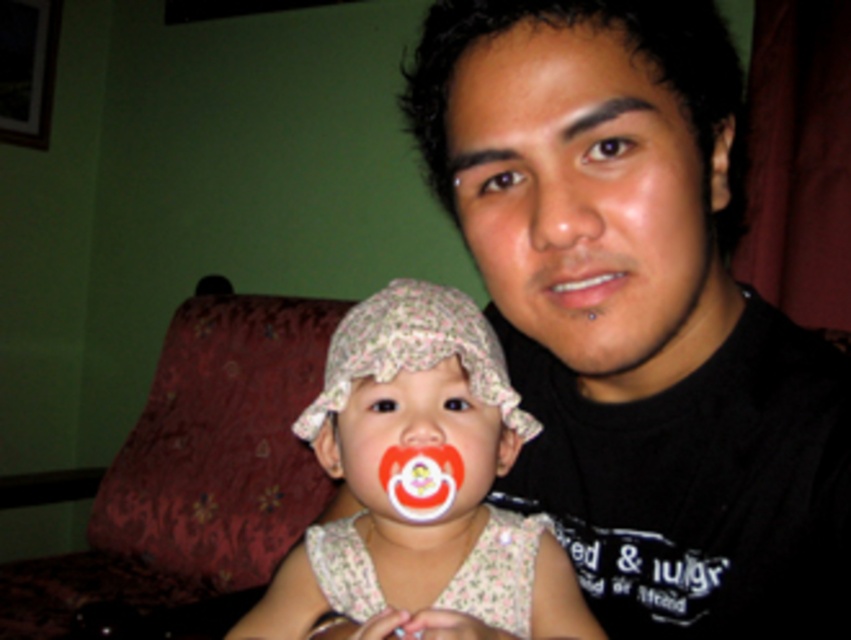
You are standing in the room and see two points marked in the image. Which point is closer to you, point (660, 188) or point (541, 76)?

Point (541, 76) is closer to you because the description states that point (660, 188) is behind point (541, 76).

Consider the image. You are a photographer trying to capture a closeup shot of both the matte black shirt at center and the matte white teeth at center in the image. The camera lens has a maximum focus range of 6 inches. Can you focus on both subjects simultaneously?

The matte black shirt at center and matte white teeth at center are 6.37 inches apart, which exceeds the camera lens maximum focus range of 6 inches. Therefore, you cannot focus on both subjects simultaneously.